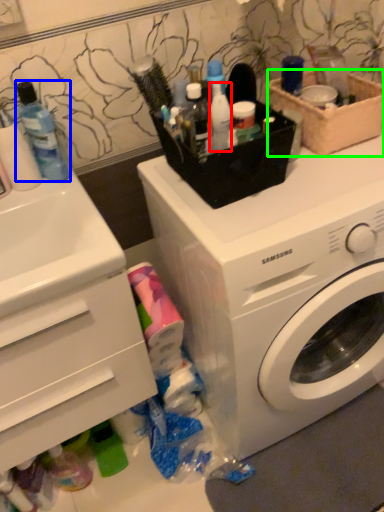
Question: Which is nearer to the toiletry (highlighted by a red box)? mouthwash (highlighted by a blue box) or basket (highlighted by a green box).

Choices:
 (A) mouthwash
 (B) basket

Answer: (B)